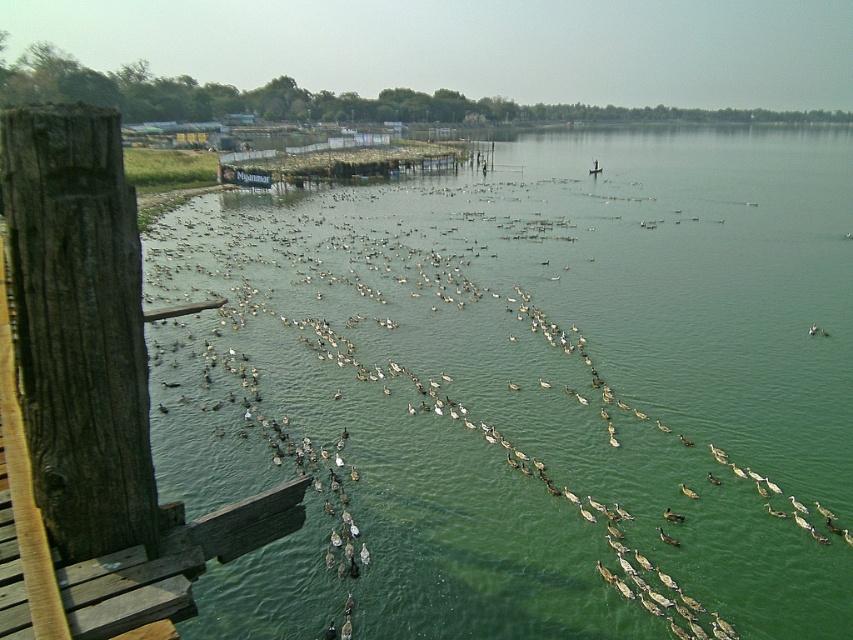
You are standing on the wooden platform and want to throw a pebble into the green water at center. To ensure it lands in the water, should you aim closer to the wooden planks at lower left or farther away from them?

Since the green water at center has a larger size compared to wooden planks at lower left, you should aim farther away from the wooden planks at lower left to ensure the pebble lands in the larger body of green water at center.

You are standing on the wooden planks at lower left and want to reach the green water at center. Which direction should you move to get there?

Since the green water at center is located above the wooden planks at lower left, you should move upward to reach the green water at center from the wooden planks at lower left.

You are standing on the wooden planks at lower left and want to reach the green water at center. Which direction should you move to get there?

You should move to the right to reach the green water at center, as it is located to the right of the wooden planks at lower left.